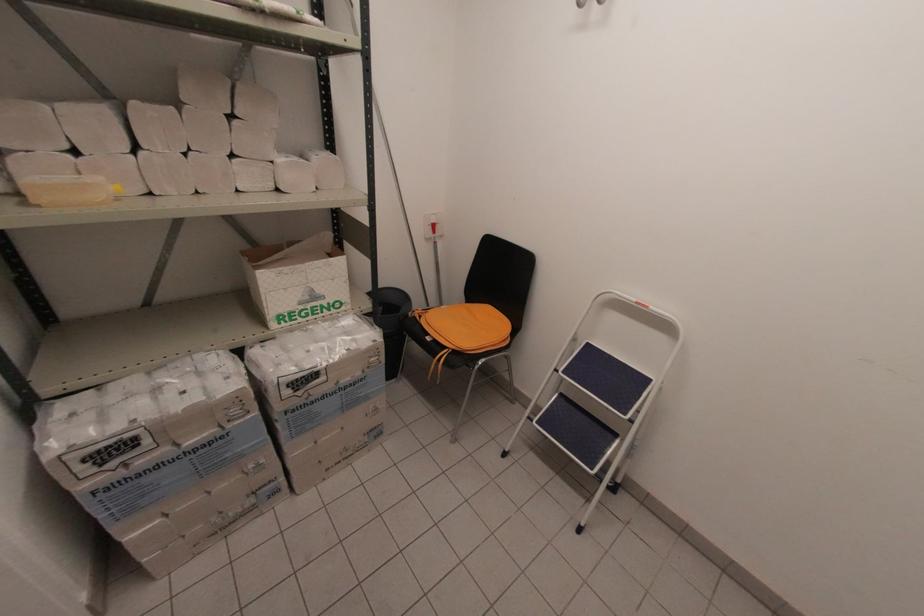
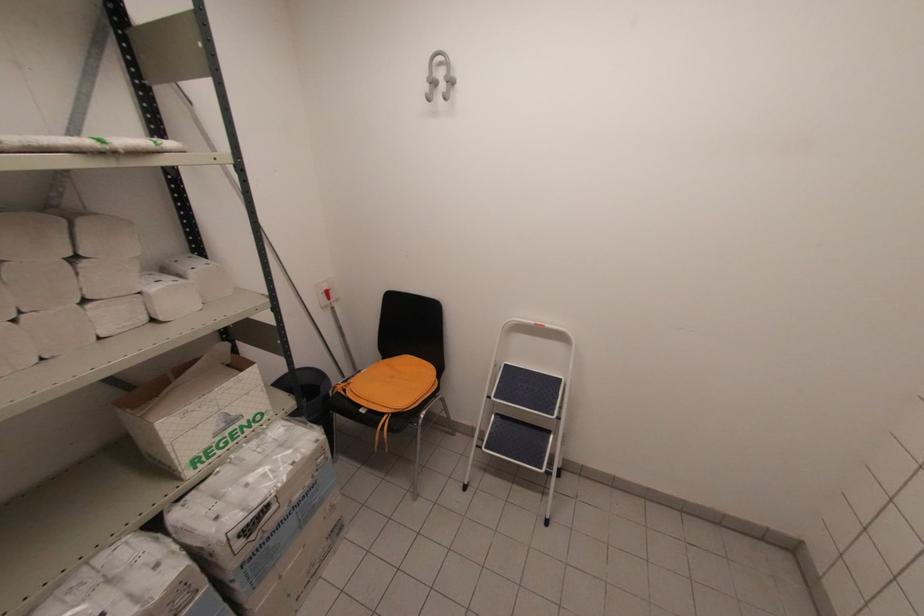
Find the pixel in the second image that matches the point at 232,113 in the first image.

(71, 254)